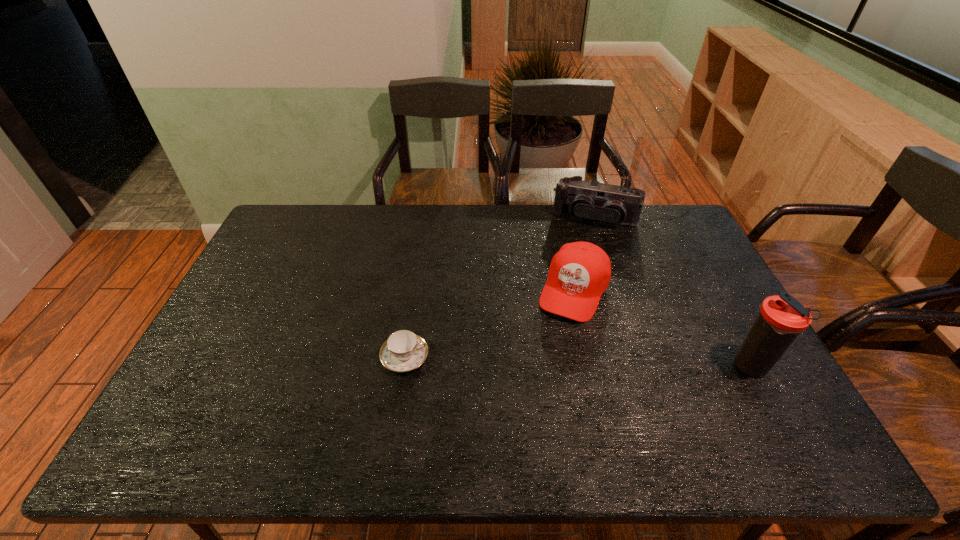
Where is `free spot on the desktop that is between the leftmost object and the thermos bottle and is positioned on the front panel of the second farthest object`? The width and height of the screenshot is (960, 540). free spot on the desktop that is between the leftmost object and the thermos bottle and is positioned on the front panel of the second farthest object is located at coordinates (540, 361).

The image size is (960, 540). I want to click on free spot on the desktop that is between the teacup and the thermos bottle and is positioned on the front-facing side of the farthest object, so click(x=555, y=361).